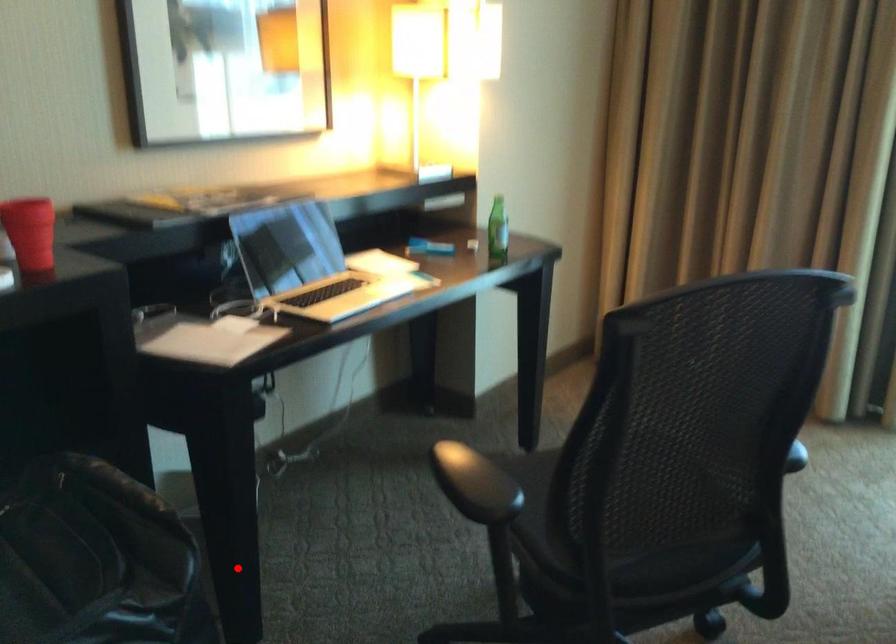
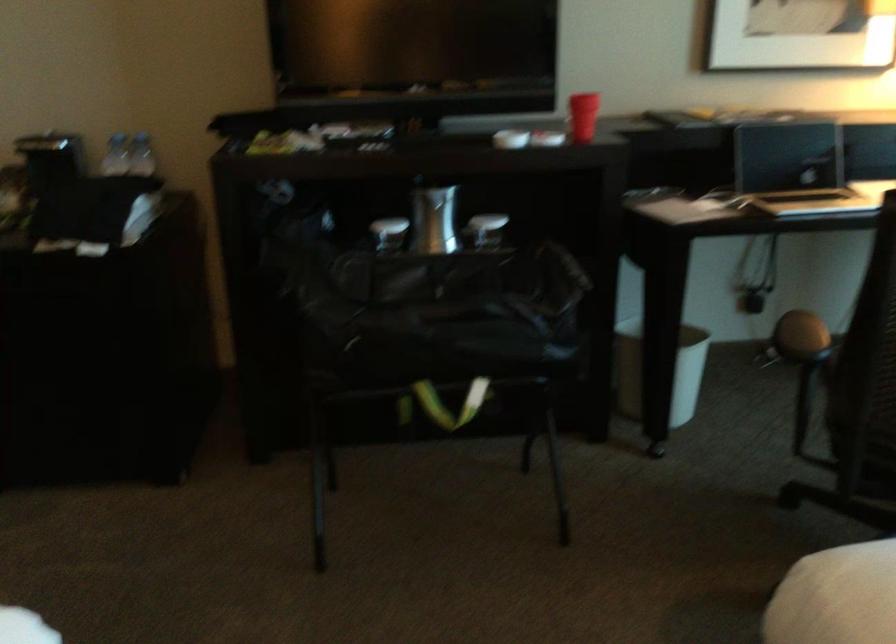
Question: A red point is marked in image1. In image2, is the corresponding 3D point closer to the camera or farther? Reply with the corresponding letter.

Choices:
 (A) The corresponding 3D point is closer.
 (B) The corresponding 3D point is farther.

Answer: (B)